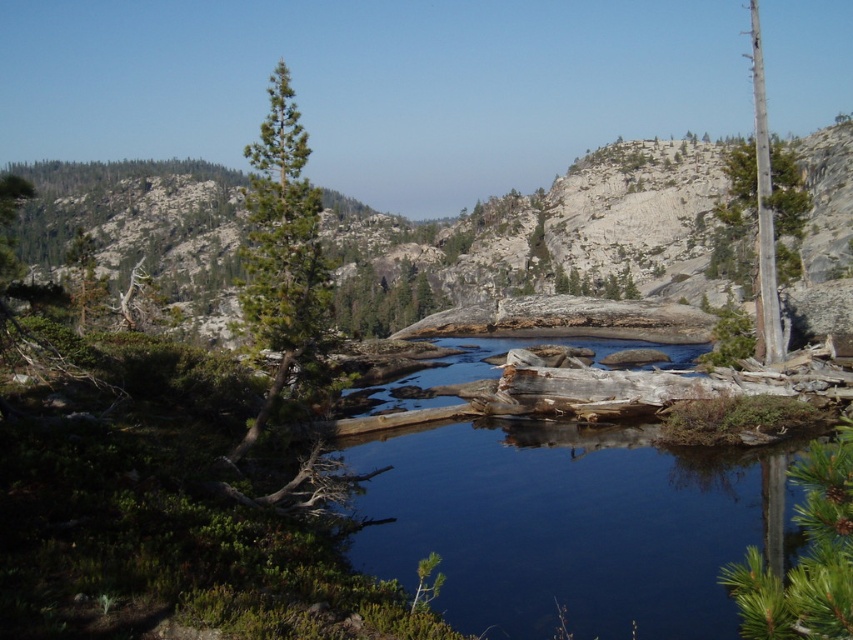
You are planning to plant a new tree in this landscape. The green matte tree at lower right is narrower than the green textured tree at center. Which tree should you choose if you want a tree that takes up more horizontal space?

A: The green textured tree at center is wider, so it takes up more horizontal space.

You are an environmental scientist studying the vegetation distribution in this mountainous area. You observe the green matte tree at lower right and the green textured tree at center. Which tree is positioned closer to the eastern horizon?

The green matte tree at lower right is positioned to the right of the green textured tree at center. Since the image is viewed from a standard perspective where left corresponds to east, the green matte tree at lower right is closer to the eastern horizon.